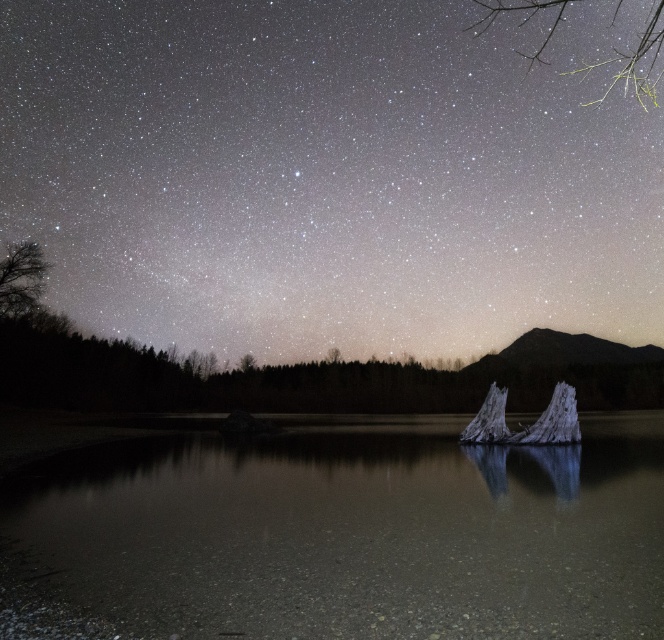
Is clear water at center to the right of white frosty tree trunk at center-right from the viewer's perspective?

In fact, clear water at center is to the left of white frosty tree trunk at center-right.

Is clear water at center wider than white frosty tree trunk at center-right?

Correct, the width of clear water at center exceeds that of white frosty tree trunk at center-right.

The image size is (664, 640). I want to click on clear water at center, so coord(339,532).

Between green leafy branches at upper right and dark brown textured tree at left, which one has less height?

Standing shorter between the two is dark brown textured tree at left.

Does green leafy branches at upper right have a lesser width compared to dark brown textured tree at left?

Incorrect, green leafy branches at upper right's width is not less than dark brown textured tree at left's.

Is point (542, 8) farther from viewer compared to point (15, 248)?

Yes, point (542, 8) is behind point (15, 248).

Where is `green leafy branches at upper right`? This screenshot has width=664, height=640. green leafy branches at upper right is located at coordinates (633, 61).

Based on the photo, is clear water at center taller than smooth gray tree trunk at center?

Yes, clear water at center is taller than smooth gray tree trunk at center.

Is clear water at center below smooth gray tree trunk at center?

Indeed, clear water at center is positioned under smooth gray tree trunk at center.

Which is behind, point (147, 552) or point (495, 413)?

Point (495, 413)

Identify the location of clear water at center. This screenshot has height=640, width=664. (339, 532).